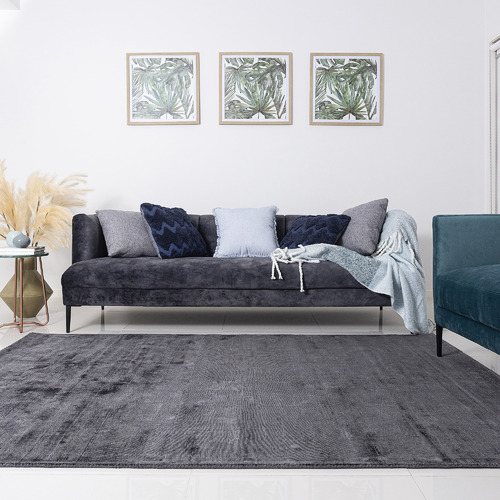
Locate an element on the screen. wall is located at coordinates (193, 151).